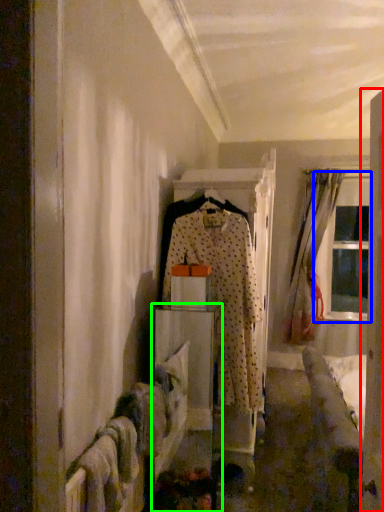
Question: Which is farther away from door (highlighted by a red box)? window (highlighted by a blue box) or furniture (highlighted by a green box)?

Choices:
 (A) window
 (B) furniture

Answer: (A)